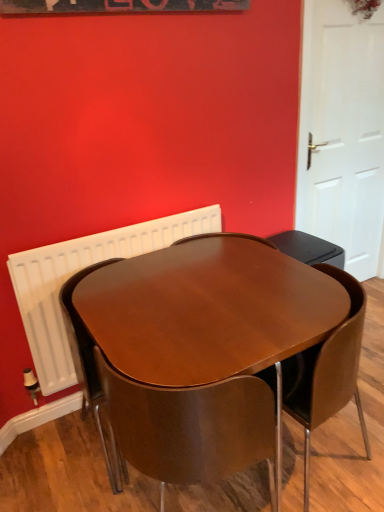
At what (x,y) coordinates should I click in order to perform the action: click on wooden chair at center, arranged as the 2th chair when viewed from the right. Please return your answer as a coordinate pair (x, y). This screenshot has width=384, height=512. Looking at the image, I should click on (188, 430).

Locate an element on the screen. The height and width of the screenshot is (512, 384). white matte door at right is located at coordinates (343, 133).

Identify the location of wooden chair at center, arranged as the 2th chair when viewed from the right. (188, 430).

Is white matte door at right in contact with white radiator at upper left?

There is a gap between white matte door at right and white radiator at upper left.

Looking at this image, from the image's perspective, which is above, white matte door at right or white radiator at upper left?

white matte door at right.

Considering the positions of objects white matte door at right and white radiator at upper left in the image provided, who is in front, white matte door at right or white radiator at upper left?

white radiator at upper left is in front.

Measure the distance from glossy wood table at center to brown leather chair at center, which is counted as the first chair, starting from the right.

A distance of 12.74 inches exists between glossy wood table at center and brown leather chair at center, which is counted as the first chair, starting from the right.

From a real-world perspective, between glossy wood table at center and brown leather chair at center, placed as the 2th chair when sorted from left to right, who is vertically higher?

brown leather chair at center, placed as the 2th chair when sorted from left to right, from a real-world perspective.

Is glossy wood table at center positioned far away from brown leather chair at center, placed as the 2th chair when sorted from left to right?

They are positioned close to each other.

Is wooden chair at center, arranged as the 2th chair when viewed from the right, not within white radiator at upper left?

wooden chair at center, arranged as the 2th chair when viewed from the right, lies outside white radiator at upper left's area.

Looking at this image, from the image's perspective, relative to white radiator at upper left, is wooden chair at center, arranged as the 2th chair when viewed from the right, above or below?

wooden chair at center, arranged as the 2th chair when viewed from the right, is situated lower than white radiator at upper left in the image.

Is wooden chair at center, arranged as the 2th chair when viewed from the right, aimed at white radiator at upper left?

Yes, wooden chair at center, arranged as the 2th chair when viewed from the right, is turned towards white radiator at upper left.

Which object is positioned more to the left, wooden chair at center, acting as the first chair starting from the left, or white radiator at upper left?

From the viewer's perspective, white radiator at upper left appears more on the left side.

Between white matte door at right and glossy wood table at center, which one appears on the left side from the viewer's perspective?

glossy wood table at center.

Does point (303, 202) appear closer or farther from the camera than point (272, 360)?

Point (303, 202).

Is glossy wood table at center a part of white matte door at right?

No, white matte door at right does not contain glossy wood table at center.

The image size is (384, 512). In order to click on door located behind the glossy wood table at center in this screenshot , I will do (x=343, y=133).

Where is `chair in front of the glossy wood table at center`? chair in front of the glossy wood table at center is located at coordinates (188, 430).

Is wooden chair at center, arranged as the 2th chair when viewed from the right, taller than glossy wood table at center?

Indeed, wooden chair at center, arranged as the 2th chair when viewed from the right, has a greater height compared to glossy wood table at center.

How many degrees apart are the facing directions of wooden chair at center, arranged as the 2th chair when viewed from the right, and glossy wood table at center?

The angle between the facing direction of wooden chair at center, arranged as the 2th chair when viewed from the right, and the facing direction of glossy wood table at center is 180 degrees.

Is wooden chair at center, arranged as the 2th chair when viewed from the right, further to the viewer compared to glossy wood table at center?

That is False.

Is wooden chair at center, arranged as the 2th chair when viewed from the right, oriented away from brown leather chair at center, placed as the 2th chair when sorted from left to right?

No, wooden chair at center, arranged as the 2th chair when viewed from the right,'s orientation is not away from brown leather chair at center, placed as the 2th chair when sorted from left to right.

Is wooden chair at center, acting as the first chair starting from the left, shorter than brown leather chair at center, which is counted as the first chair, starting from the right?

Correct, wooden chair at center, acting as the first chair starting from the left, is not as tall as brown leather chair at center, which is counted as the first chair, starting from the right.

From a real-world perspective, which is physically above, wooden chair at center, acting as the first chair starting from the left, or brown leather chair at center, which is counted as the first chair, starting from the right?

From a 3D spatial view, wooden chair at center, acting as the first chair starting from the left, is above.

Considering the sizes of wooden chair at center, acting as the first chair starting from the left, and brown leather chair at center, placed as the 2th chair when sorted from left to right, in the image, is wooden chair at center, acting as the first chair starting from the left, wider or thinner than brown leather chair at center, placed as the 2th chair when sorted from left to right,?

wooden chair at center, acting as the first chair starting from the left, is thinner than brown leather chair at center, placed as the 2th chair when sorted from left to right.

What's the angular difference between white radiator at upper left and wooden chair at center, arranged as the 2th chair when viewed from the right,'s facing directions?

They differ by 180 degrees in their facing directions.

Can you confirm if white radiator at upper left is shorter than wooden chair at center, acting as the first chair starting from the left?

Indeed, white radiator at upper left has a lesser height compared to wooden chair at center, acting as the first chair starting from the left.

From a real-world perspective, is white radiator at upper left positioned over wooden chair at center, acting as the first chair starting from the left, based on gravity?

Yes.

Is wooden chair at center, acting as the first chair starting from the left, at the back of white radiator at upper left?

No, wooden chair at center, acting as the first chair starting from the left, is not at the back of white radiator at upper left.

The height and width of the screenshot is (512, 384). Identify the location of door above the white radiator at upper left (from the image's perspective). (343, 133).

You are a GUI agent. You are given a task and a screenshot of the screen. Output one action in this format:
    pyautogui.click(x=<x>, y=<y>)
    Task: Click on the chair behind the glossy wood table at center
    
    Given the screenshot: What is the action you would take?
    pyautogui.click(x=330, y=371)

Based on their spatial positions, is glossy wood table at center or brown leather chair at center, which is counted as the first chair, starting from the right, closer to white radiator at upper left?

glossy wood table at center is positioned closer to the anchor white radiator at upper left.

Which object lies further to the anchor point wooden chair at center, acting as the first chair starting from the left, brown leather chair at center, which is counted as the first chair, starting from the right, or glossy wood table at center?

brown leather chair at center, which is counted as the first chair, starting from the right.

Estimate the real-world distances between objects in this image. Which object is closer to glossy wood table at center, brown leather chair at center, placed as the 2th chair when sorted from left to right, or white radiator at upper left?

Based on the image, brown leather chair at center, placed as the 2th chair when sorted from left to right, appears to be nearer to glossy wood table at center.

From the picture: Based on their spatial positions, is white matte door at right or brown leather chair at center, which is counted as the first chair, starting from the right, closer to white radiator at upper left?

brown leather chair at center, which is counted as the first chair, starting from the right, is closer to white radiator at upper left.

From the image, which object appears to be nearer to glossy wood table at center, white radiator at upper left or wooden chair at center, acting as the first chair starting from the left?

wooden chair at center, acting as the first chair starting from the left, is positioned closer to the anchor glossy wood table at center.

Looking at the image, which one is located closer to white radiator at upper left, wooden chair at center, acting as the first chair starting from the left, or white matte door at right?

The object closer to white radiator at upper left is wooden chair at center, acting as the first chair starting from the left.

From the image, which object appears to be farther from brown leather chair at center, placed as the 2th chair when sorted from left to right, white matte door at right or glossy wood table at center?

white matte door at right is further to brown leather chair at center, placed as the 2th chair when sorted from left to right.

Looking at this image, when comparing their distances from wooden chair at center, acting as the first chair starting from the left, does white radiator at upper left or brown leather chair at center, which is counted as the first chair, starting from the right, seem closer?

brown leather chair at center, which is counted as the first chair, starting from the right, is positioned closer to the anchor wooden chair at center, acting as the first chair starting from the left.

Locate an element on the screen. chair between white radiator at upper left and brown leather chair at center, which is counted as the first chair, starting from the right is located at coordinates (188, 430).

You are a GUI agent. You are given a task and a screenshot of the screen. Output one action in this format:
    pyautogui.click(x=<x>, y=<y>)
    Task: Click on the chair that lies between white matte door at right and glossy wood table at center from top to bottom
    The image size is (384, 512).
    Given the screenshot: What is the action you would take?
    pyautogui.click(x=330, y=371)

The height and width of the screenshot is (512, 384). Identify the location of table located between wooden chair at center, arranged as the 2th chair when viewed from the right, and brown leather chair at center, which is counted as the first chair, starting from the right, in the left-right direction. (195, 344).

Where is `table located between white radiator at upper left and white matte door at right in the left-right direction`? Image resolution: width=384 pixels, height=512 pixels. table located between white radiator at upper left and white matte door at right in the left-right direction is located at coordinates (195, 344).